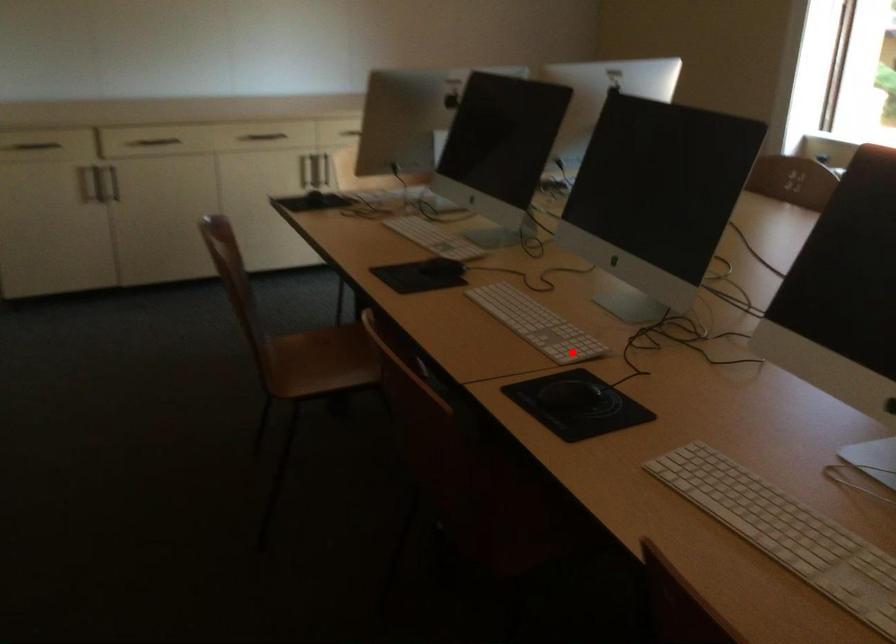
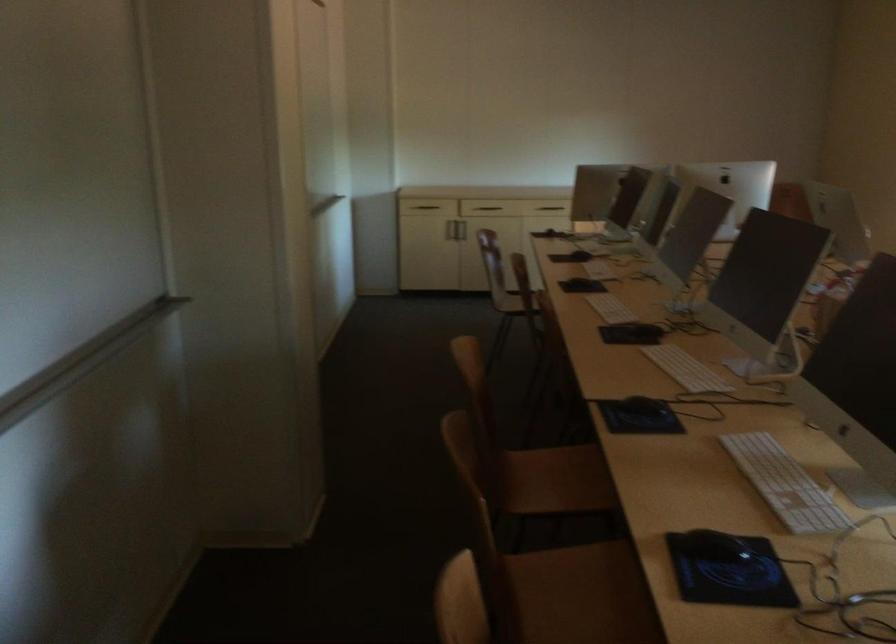
Find the pixel in the second image that matches the highlighted location in the first image.

(599, 269)